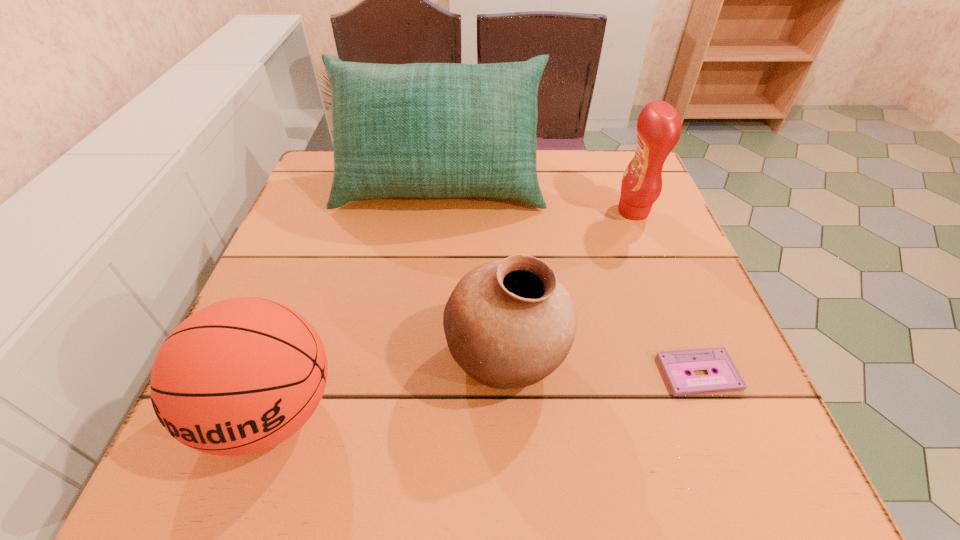
This screenshot has width=960, height=540. What are the coordinates of `free location located on the left of the videotape` in the screenshot? It's located at (544, 373).

This screenshot has width=960, height=540. Identify the location of cushion that is at the far edge. (425, 130).

This screenshot has height=540, width=960. What are the coordinates of `condiment that is at the far edge` in the screenshot? It's located at (659, 127).

I want to click on object positioned at the near edge, so click(x=242, y=375).

Identify the location of cushion that is at the left edge. The image size is (960, 540). (425, 130).

Where is `basketball located at the left edge`? basketball located at the left edge is located at coordinates (242, 375).

This screenshot has height=540, width=960. What are the coordinates of `condiment situated at the right edge` in the screenshot? It's located at (659, 127).

Identify the location of videotape at the right edge. The width and height of the screenshot is (960, 540). (675, 364).

Image resolution: width=960 pixels, height=540 pixels. I want to click on object at the far left corner, so click(x=425, y=130).

I want to click on object at the near left corner, so [242, 375].